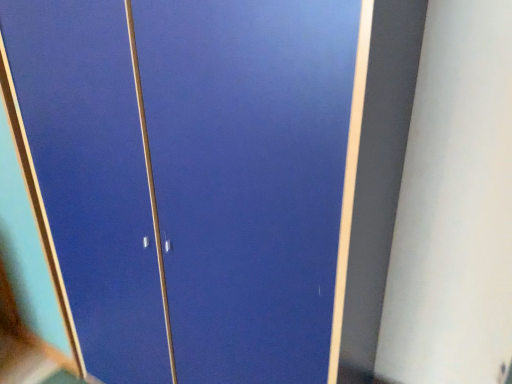
What do you see at coordinates (92, 176) in the screenshot? This screenshot has width=512, height=384. I see `matte blue door at center` at bounding box center [92, 176].

Where is `matte blue door at center`? Image resolution: width=512 pixels, height=384 pixels. matte blue door at center is located at coordinates (92, 176).

Measure the distance between point (104, 280) and camera.

The depth of point (104, 280) is 1.33 meters.

At what (x,y) coordinates should I click in order to perform the action: click on matte blue door at center. Please return your answer as a coordinate pair (x, y). The width and height of the screenshot is (512, 384). Looking at the image, I should click on (92, 176).